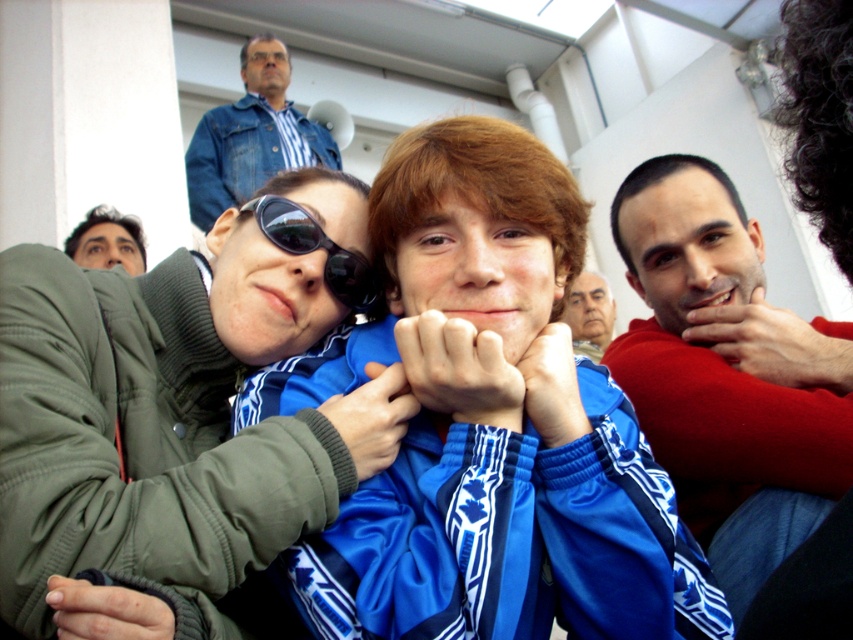
Question: Is smooth red sweater at right to the right of smooth skin face at lower left from the viewer's perspective?

Choices:
 (A) no
 (B) yes

Answer: (B)

Question: Does smooth red sweater at right come in front of smooth skin face at lower left?

Choices:
 (A) yes
 (B) no

Answer: (A)

Question: Which of the following is the farthest from the observer?

Choices:
 (A) (64, 560)
 (B) (241, 157)
 (C) (117, 216)
 (D) (694, 353)

Answer: (B)

Question: Which point is farther to the camera?

Choices:
 (A) blue satin jacket at center
 (B) smooth red sweater at right

Answer: (B)

Question: Among these objects, which one is farthest from the camera?

Choices:
 (A) smooth skin face at center
 (B) blue satin jacket at center
 (C) smooth skin face at lower left
 (D) green matte jacket at center

Answer: (A)

Question: Is blue satin jacket at center wider than smooth red sweater at right?

Choices:
 (A) no
 (B) yes

Answer: (B)